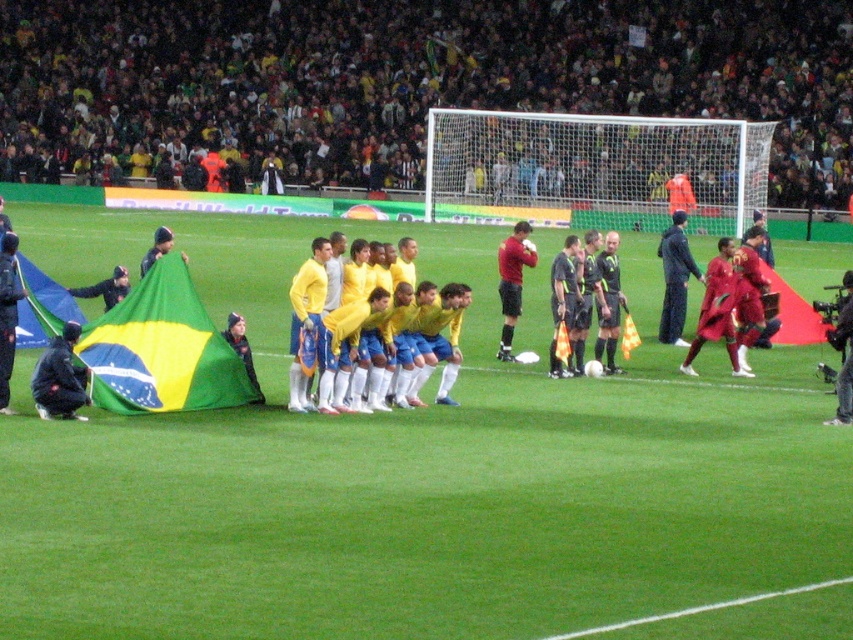
Does dark blue fabric jacket at center appear over matte red shirt at center?

Incorrect, dark blue fabric jacket at center is not positioned above matte red shirt at center.

Between point (675, 336) and point (509, 336), which one is positioned in front?

Point (509, 336) is more forward.

This screenshot has width=853, height=640. What are the coordinates of `dark blue fabric jacket at center` in the screenshot? It's located at (675, 278).

Can you confirm if yellow matte/synthetic uniform at center is bigger than black matte jacket at lower left?

Indeed, yellow matte/synthetic uniform at center has a larger size compared to black matte jacket at lower left.

Is point (379, 346) closer to camera compared to point (73, 381)?

That is False.

This screenshot has width=853, height=640. In order to click on yellow matte/synthetic uniform at center in this screenshot , I will do `click(343, 346)`.

The image size is (853, 640). Find the location of `yellow matte/synthetic uniform at center`. yellow matte/synthetic uniform at center is located at coordinates (343, 346).

Between point (345, 358) and point (500, 276), which one is positioned behind?

The point (500, 276) is behind.

This screenshot has width=853, height=640. What do you see at coordinates (343, 346) in the screenshot?
I see `yellow matte/synthetic uniform at center` at bounding box center [343, 346].

Measure the distance between point (387, 300) and camera.

They are 49.03 feet apart.

This screenshot has width=853, height=640. I want to click on yellow matte/synthetic uniform at center, so click(343, 346).